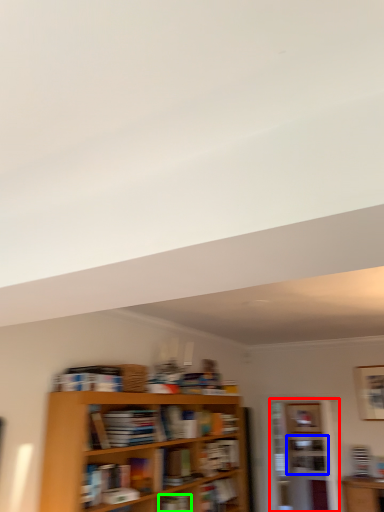
Question: Considering the real-world distances, which object is closest to shelf (highlighted by a red box)? cabinet (highlighted by a blue box) or book (highlighted by a green box).

Choices:
 (A) cabinet
 (B) book

Answer: (A)